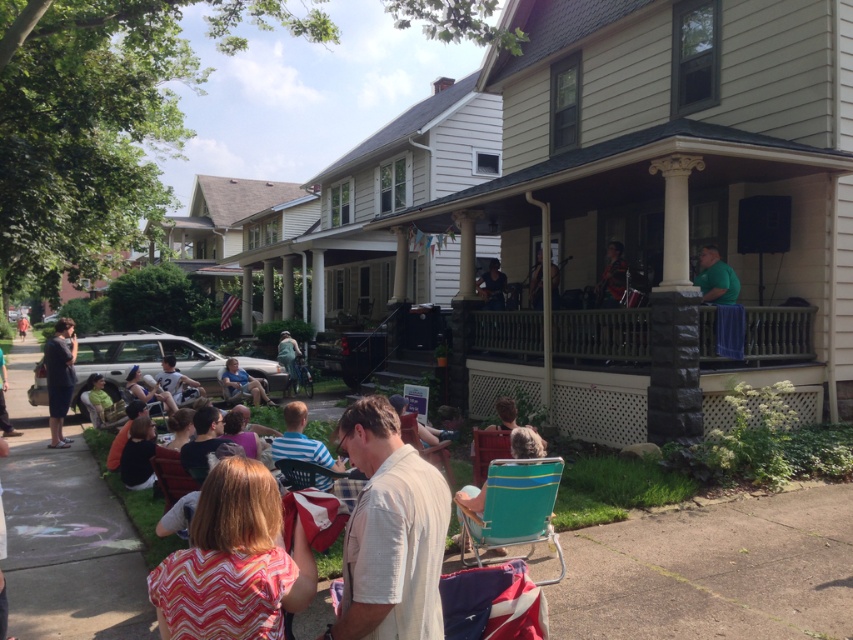
You are standing at the front of the porch where the band is playing. Looking out at the crowd, which of the two people is positioned closer to the ground, the multicolored zigzag shirt at lower left or the dark blue shirt at center?

The multicolored zigzag shirt at lower left is located below the dark blue shirt at center, so the multicolored zigzag shirt at lower left is closer to the ground.

Based on the photo, you are a photographer trying to capture a photo of the dark blue shirt at center without the multicolored zigzag shirt at lower left blocking it. What should you do?

Move your position to the side so that the dark blue shirt at center is no longer behind the multicolored zigzag shirt at lower left. Since the multicolored zigzag shirt at lower left is in front of dark blue shirt at center, moving sideways can allow you to see the dark blue shirt at center without obstruction.

You are standing at point (486,307) and want to walk towards the band on the porch. There is an obstacle at point (238,524). Will you have to go around it?

Point (238,524) is in front of point (486,307), so you will have to go around the obstacle at point (238,524) to reach the band on the porch.